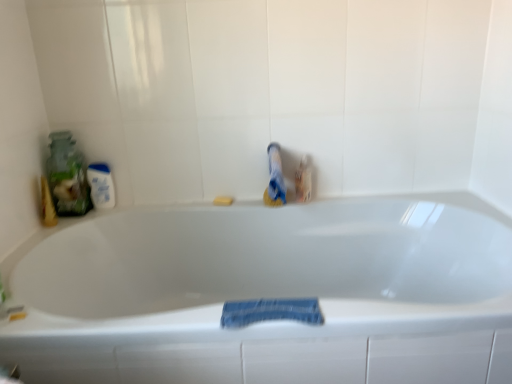
Question: Is white glossy mouthwash at left not within white glossy bathtub at center?

Choices:
 (A) no
 (B) yes

Answer: (B)

Question: Can you confirm if white glossy mouthwash at left is shorter than white glossy bathtub at center?

Choices:
 (A) no
 (B) yes

Answer: (B)

Question: Is white glossy mouthwash at left beside white glossy bathtub at center?

Choices:
 (A) yes
 (B) no

Answer: (B)

Question: Is white glossy mouthwash at left positioned with its back to white glossy bathtub at center?

Choices:
 (A) yes
 (B) no

Answer: (B)

Question: Is white glossy mouthwash at left in front of white glossy bathtub at center?

Choices:
 (A) yes
 (B) no

Answer: (B)

Question: Is white glossy bathtub at center spatially inside translucent glass jar at left, or outside of it?

Choices:
 (A) outside
 (B) inside

Answer: (A)

Question: Is white glossy bathtub at center in front of or behind translucent glass jar at left in the image?

Choices:
 (A) behind
 (B) front

Answer: (B)

Question: Is point [x=215, y=259] closer or farther from the camera than point [x=61, y=215]?

Choices:
 (A) closer
 (B) farther

Answer: (B)

Question: In terms of width, does white glossy bathtub at center look wider or thinner when compared to translucent glass jar at left?

Choices:
 (A) thin
 (B) wide

Answer: (B)

Question: Looking at their shapes, would you say faded denim towel at lower center is wider or thinner than translucent glass jar at left?

Choices:
 (A) wide
 (B) thin

Answer: (B)

Question: Based on their positions, is faded denim towel at lower center located to the left or right of translucent glass jar at left?

Choices:
 (A) left
 (B) right

Answer: (B)

Question: Is faded denim towel at lower center spatially inside translucent glass jar at left, or outside of it?

Choices:
 (A) inside
 (B) outside

Answer: (B)

Question: From the image's perspective, is faded denim towel at lower center located above or below translucent glass jar at left?

Choices:
 (A) above
 (B) below

Answer: (B)

Question: Choose the correct answer: Is white glossy bathtub at center inside yellow sponge at center or outside it?

Choices:
 (A) inside
 (B) outside

Answer: (B)

Question: Looking at the image, does white glossy bathtub at center seem bigger or smaller compared to yellow sponge at center?

Choices:
 (A) big
 (B) small

Answer: (A)